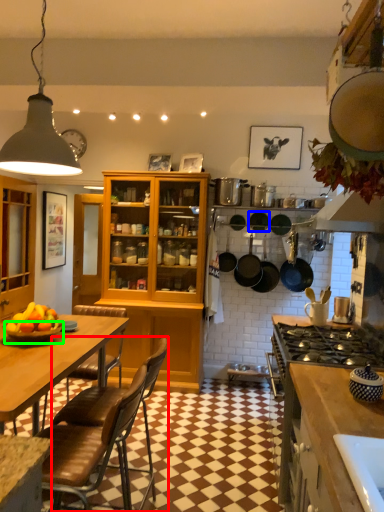
Question: Considering the real-world distances, which object is closest to chair (highlighted by a red box)? frying pan (highlighted by a blue box) or bowl (highlighted by a green box).

Choices:
 (A) frying pan
 (B) bowl

Answer: (B)